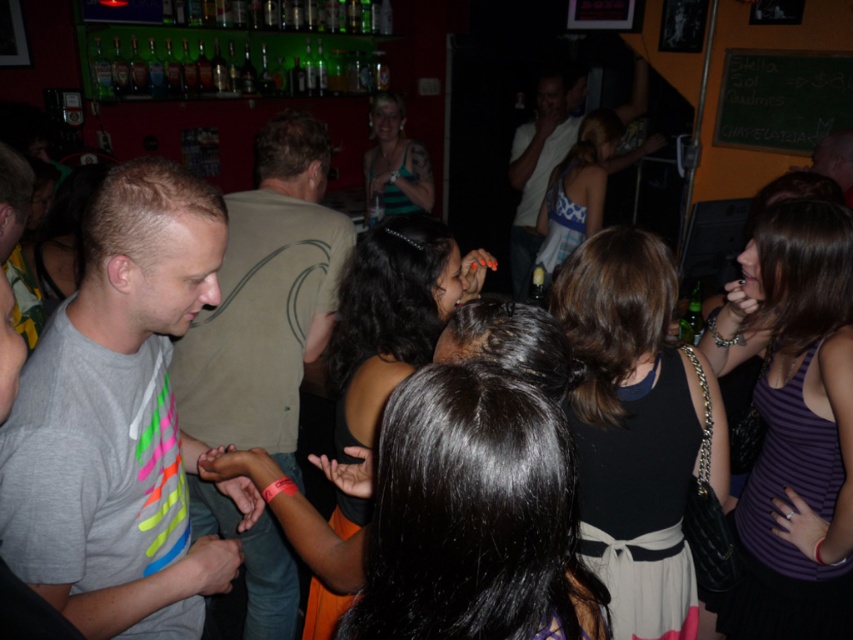
Question: Estimate the real-world distances between objects in this image. Which object is farther from the gray cotton t-shirt at left?

Choices:
 (A) gray matte t-shirt at left
 (B) white matte shirt at center

Answer: (B)

Question: Considering the real-world distances, which object is farthest from the gray matte t-shirt at left?

Choices:
 (A) gray cotton t-shirt at left
 (B) white matte shirt at center

Answer: (B)

Question: Does gray cotton t-shirt at left appear on the right side of gray matte t-shirt at left?

Choices:
 (A) yes
 (B) no

Answer: (A)

Question: Can you confirm if gray matte t-shirt at left is thinner than white matte shirt at center?

Choices:
 (A) no
 (B) yes

Answer: (A)

Question: Observing the image, what is the correct spatial positioning of gray cotton t-shirt at left in reference to white matte shirt at center?

Choices:
 (A) above
 (B) below

Answer: (B)

Question: Which point is closer to the camera taking this photo?

Choices:
 (A) (538, 147)
 (B) (207, 384)

Answer: (B)